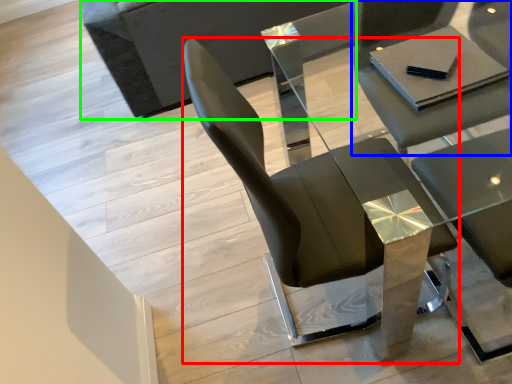
Question: Which object is the farthest from chair (highlighted by a red box)? Choose among these: chair (highlighted by a blue box) or couch (highlighted by a green box).

Choices:
 (A) chair
 (B) couch

Answer: (B)